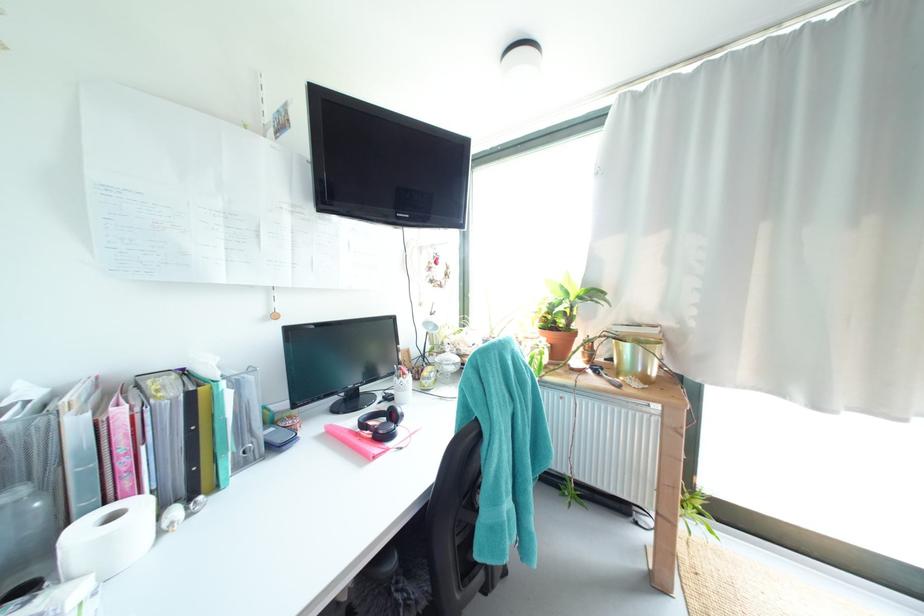
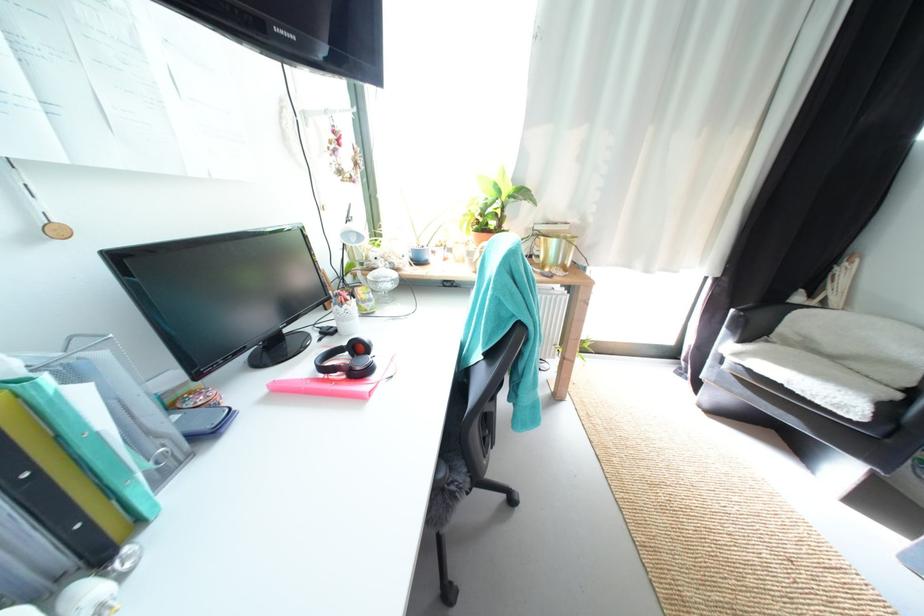
Locate, in the second image, the point that corresponds to the point at 388,434 in the first image.

(367, 370)